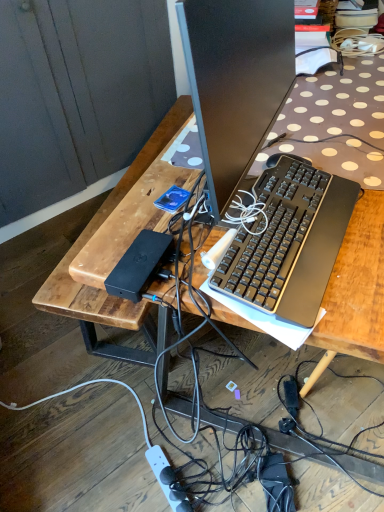
Identify the location of vacant space that is to the left of white plastic power outlet at lower center. (115, 478).